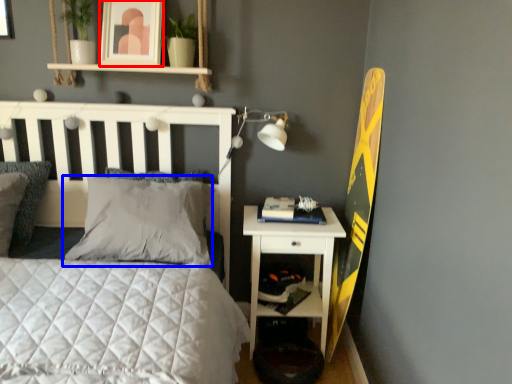
Question: Among these objects, which one is nearest to the camera, picture frame (highlighted by a red box) or pillow (highlighted by a blue box)?

Choices:
 (A) picture frame
 (B) pillow

Answer: (B)